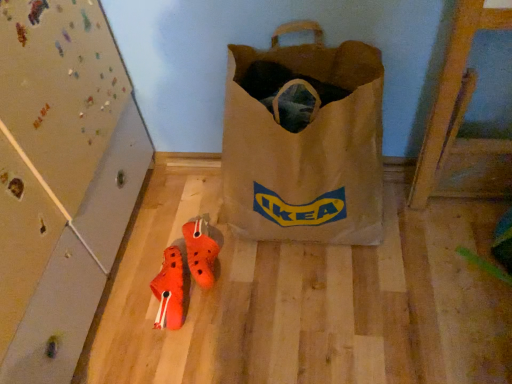
At what (x,y) coordinates should I click in order to perform the action: click on free space to the back side of orange matte sneakers at lower center, arranged as the first footwear when viewed from the left. Please return your answer as a coordinate pair (x, y). The image size is (512, 384). Looking at the image, I should click on (162, 238).